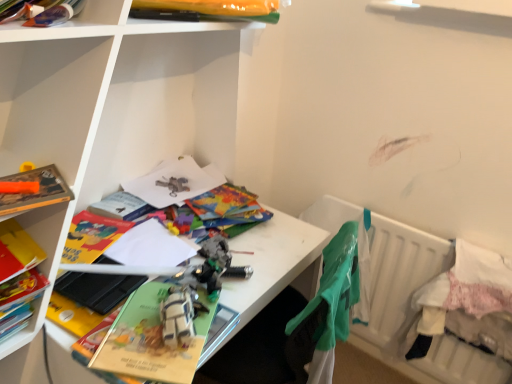
Locate an element on the screen. The height and width of the screenshot is (384, 512). free space in front of white plastic toy at center is located at coordinates (159, 362).